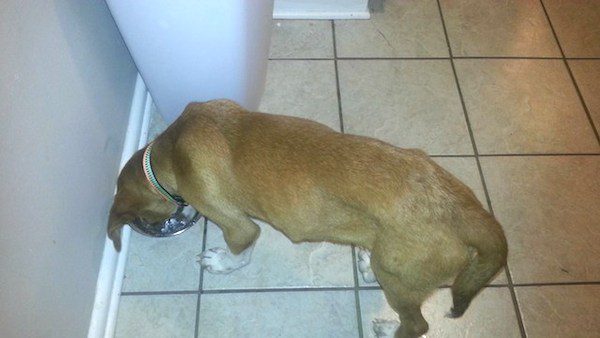
Locate an element on the screen. The width and height of the screenshot is (600, 338). bathroom wall is located at coordinates (52, 114).